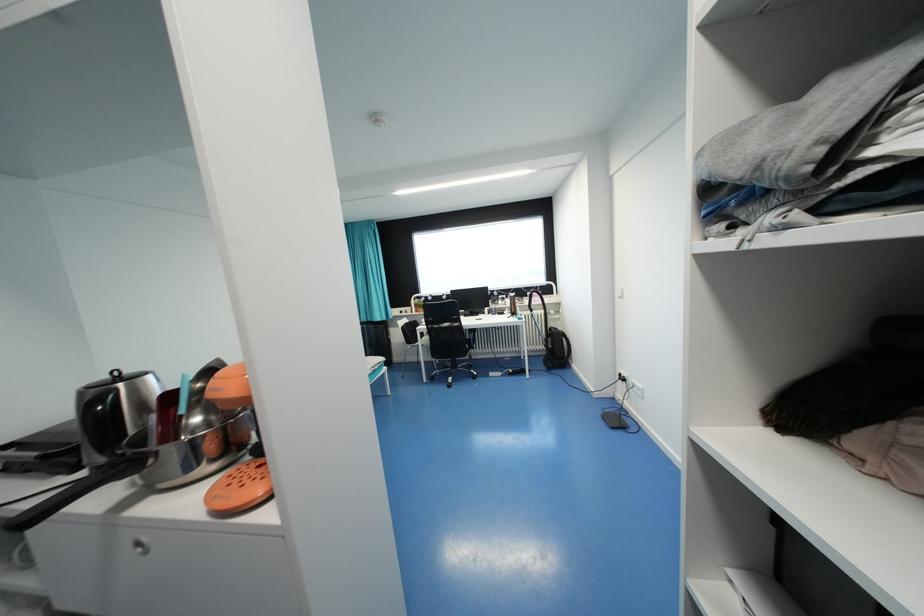
I want to click on orange plastic strainer, so click(x=238, y=488).